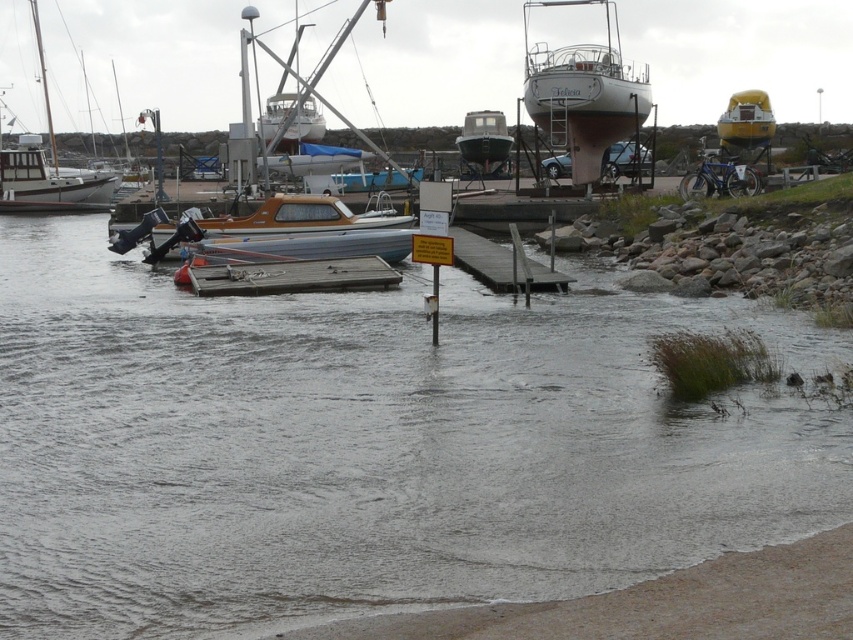
Is brushed metal boat at left wider than yellow matte boat at upper right?

Yes, brushed metal boat at left is wider than yellow matte boat at upper right.

Is brushed metal boat at left shorter than yellow matte boat at upper right?

No.

Where is `brushed metal boat at left`? The image size is (853, 640). brushed metal boat at left is located at coordinates (45, 168).

Which is behind, point (236, 220) or point (253, 268)?

Positioned behind is point (236, 220).

Is wooden polished boat at center positioned in front of wooden dock at center?

No, it is not.

Who is more forward, (248, 218) or (306, 285)?

Point (306, 285) is in front.

Identify the location of wooden polished boat at center. This screenshot has height=640, width=853. (247, 224).

The image size is (853, 640). What do you see at coordinates (583, 92) in the screenshot?
I see `white glossy boat at center` at bounding box center [583, 92].

Is white glossy boat at center thinner than brushed metal boat at left?

Indeed, white glossy boat at center has a lesser width compared to brushed metal boat at left.

Which is in front, point (596, 177) or point (1, 204)?

Point (596, 177) is more forward.

Locate an element on the screen. Image resolution: width=853 pixels, height=640 pixels. white glossy boat at center is located at coordinates (583, 92).